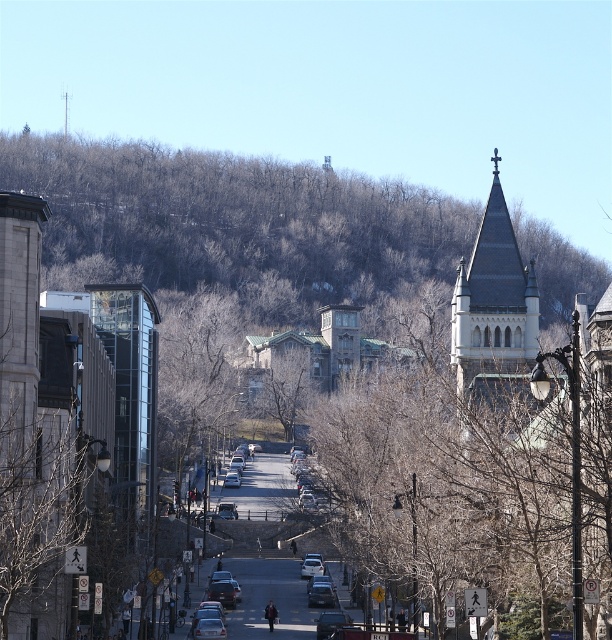
This screenshot has height=640, width=612. What do you see at coordinates (476, 477) in the screenshot?
I see `bare branches at center` at bounding box center [476, 477].

Does point (338, 468) come farther from viewer compared to point (2, 637)?

Yes, it is.

The image size is (612, 640). I want to click on bare branches at center, so click(476, 477).

Which is above, bare branches at center or brown leafless tree at center?

brown leafless tree at center is above.

Is bare branches at center closer to camera compared to brown leafless tree at center?

Yes, bare branches at center is in front of brown leafless tree at center.

Who is more distant from viewer, (610, 563) or (258, 374)?

Point (258, 374)

The height and width of the screenshot is (640, 612). I want to click on bare branches at center, so click(x=476, y=477).

Which is below, bare branches at left or brown leafless tree at center?

bare branches at left is below.

Does bare branches at left appear over brown leafless tree at center?

Incorrect, bare branches at left is not positioned above brown leafless tree at center.

You are a GUI agent. You are given a task and a screenshot of the screen. Output one action in this format:
    pyautogui.click(x=<x>, y=<y>)
    Task: Click on the bare branches at left
    Image resolution: width=612 pixels, height=640 pixels.
    Given the screenshot: What is the action you would take?
    pyautogui.click(x=40, y=499)